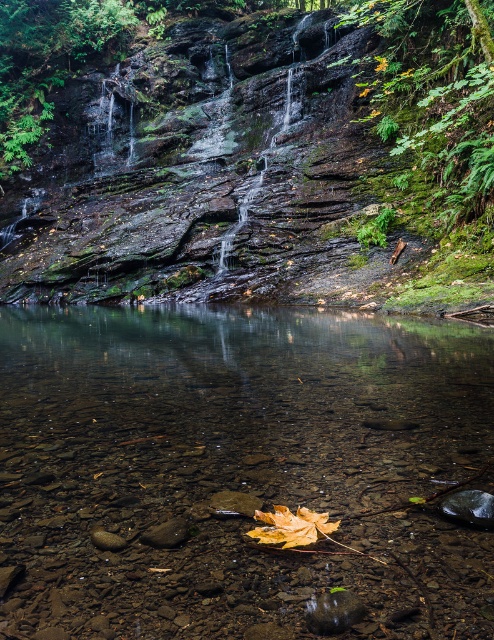
Question: Does green mossy rock at upper center appear on the left side of yellow matte maple leaf at lower center?

Choices:
 (A) yes
 (B) no

Answer: (A)

Question: Which of the following is the closest to the observer?

Choices:
 (A) yellow matte maple leaf at lower center
 (B) green mossy rock at upper center
 (C) smooth brown rock at lower center

Answer: (A)

Question: Can you confirm if green mossy rock at upper center is positioned to the right of yellow matte maple leaf at lower center?

Choices:
 (A) yes
 (B) no

Answer: (B)

Question: Estimate the real-world distances between objects in this image. Which object is farther from the yellow matte maple leaf at lower center?

Choices:
 (A) smooth brown rock at lower center
 (B) green mossy rock at upper center
 (C) clear glass stream at center

Answer: (B)

Question: Does clear glass stream at center have a smaller size compared to green mossy rock at upper center?

Choices:
 (A) yes
 (B) no

Answer: (A)

Question: Which object is farther from the camera taking this photo?

Choices:
 (A) clear glass stream at center
 (B) smooth brown rock at lower center
 (C) green mossy rock at upper center
 (D) yellow matte maple leaf at lower center

Answer: (C)